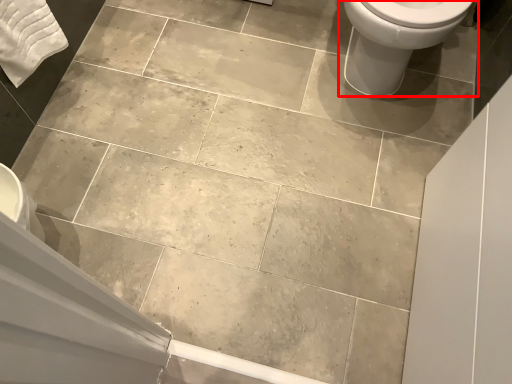
Question: Considering the relative positions of toilet (annotated by the red box) and bath towel in the image provided, where is toilet (annotated by the red box) located with respect to the staircase?

Choices:
 (A) right
 (B) left

Answer: (A)